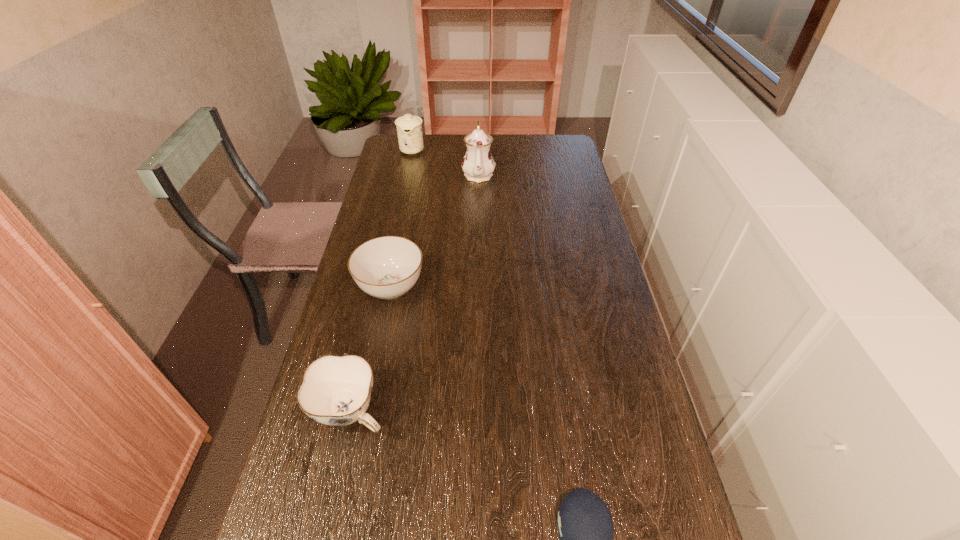
At what (x,y) coordinates should I click in order to perform the action: click on free space that satisfies the following two spatial constraints: 1. on the spout of the farthest chinaware; 2. on the left side of the second nearest chinaware. Please return your answer as a coordinate pair (x, y). This screenshot has height=540, width=960. Looking at the image, I should click on (383, 288).

This screenshot has height=540, width=960. In order to click on vacant space that satisfies the following two spatial constraints: 1. on the spout of the farthest chinaware; 2. on the left side of the second nearest chinaware in this screenshot , I will do `click(383, 288)`.